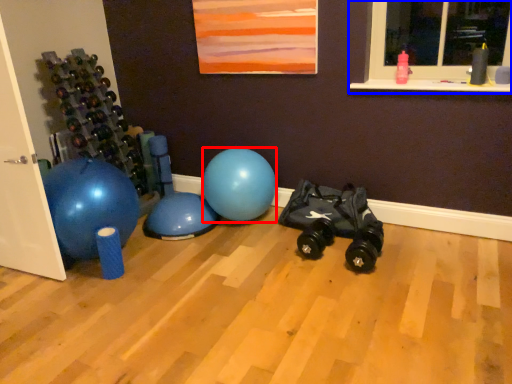
Question: Which object is closer to the camera taking this photo, ball (highlighted by a red box) or window (highlighted by a blue box)?

Choices:
 (A) ball
 (B) window

Answer: (B)